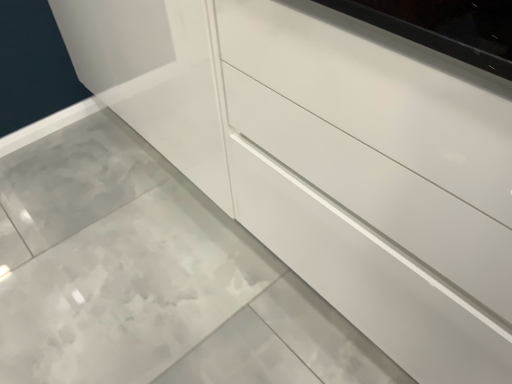
What do you see at coordinates (379, 193) in the screenshot? Image resolution: width=512 pixels, height=384 pixels. I see `white glossy drawer at center` at bounding box center [379, 193].

Where is `white glossy drawer at center`? The width and height of the screenshot is (512, 384). white glossy drawer at center is located at coordinates (379, 193).

Where is `white glossy drawer at center`? This screenshot has width=512, height=384. white glossy drawer at center is located at coordinates pyautogui.click(x=379, y=193).